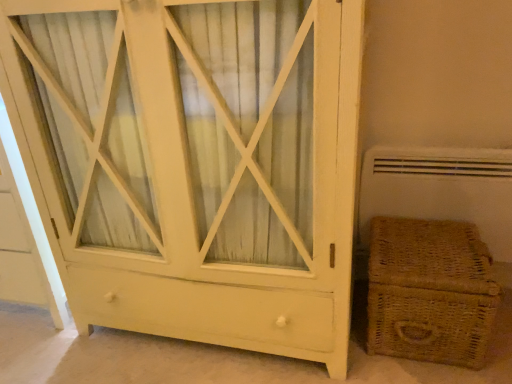
At what (x,y) coordinates should I click in order to perform the action: click on braided wicker basket at lower right. Please return your answer as a coordinate pair (x, y). The height and width of the screenshot is (384, 512). Looking at the image, I should click on (430, 291).

Describe the element at coordinates (430, 291) in the screenshot. I see `braided wicker basket at lower right` at that location.

This screenshot has width=512, height=384. Describe the element at coordinates (196, 175) in the screenshot. I see `white wood cabinet at center` at that location.

Find the location of a particular element. Image resolution: width=512 pixels, height=384 pixels. white wood cabinet at center is located at coordinates (196, 175).

The height and width of the screenshot is (384, 512). Find the location of `braided wicker basket at lower right`. braided wicker basket at lower right is located at coordinates (430, 291).

Considering the positions of objects white wood cabinet at center and braided wicker basket at lower right in the image provided, who is more to the left, white wood cabinet at center or braided wicker basket at lower right?

white wood cabinet at center is more to the left.

Is the depth of white wood cabinet at center less than that of braided wicker basket at lower right?

Yes, it is in front of braided wicker basket at lower right.

Does point (172, 86) lie behind point (484, 360)?

No, it is in front of (484, 360).

From the image's perspective, is white wood cabinet at center above braided wicker basket at lower right?

Indeed, from the image's perspective, white wood cabinet at center is shown above braided wicker basket at lower right.

From a real-world perspective, which object stands above the other?

white wood cabinet at center is physically above.

Which object is wider, white wood cabinet at center or braided wicker basket at lower right?

With larger width is white wood cabinet at center.

Is white wood cabinet at center shorter than braided wicker basket at lower right?

No, white wood cabinet at center is not shorter than braided wicker basket at lower right.

Can you confirm if white wood cabinet at center is bigger than braided wicker basket at lower right?

Indeed, white wood cabinet at center has a larger size compared to braided wicker basket at lower right.

Is white wood cabinet at center positioned beyond the bounds of braided wicker basket at lower right?

white wood cabinet at center lies outside braided wicker basket at lower right's area.

Is white wood cabinet at center with braided wicker basket at lower right?

white wood cabinet at center and braided wicker basket at lower right are clearly separated.

Is white wood cabinet at center positioned with its back to braided wicker basket at lower right?

That's not correct — white wood cabinet at center is not looking away from braided wicker basket at lower right.

How different are the orientations of white wood cabinet at center and braided wicker basket at lower right in degrees?

The facing directions of white wood cabinet at center and braided wicker basket at lower right are 1.19 degrees apart.

Measure the distance from white wood cabinet at center to braided wicker basket at lower right.

white wood cabinet at center is 20.46 inches from braided wicker basket at lower right.

You are a GUI agent. You are given a task and a screenshot of the screen. Output one action in this format:
    pyautogui.click(x=<x>, y=<y>)
    Task: Click on the chest of drawers on the left of braided wicker basket at lower right
    Image resolution: width=512 pixels, height=384 pixels.
    Given the screenshot: What is the action you would take?
    pyautogui.click(x=196, y=175)

In the image, is braided wicker basket at lower right on the left side or the right side of white wood cabinet at center?

In the image, braided wicker basket at lower right appears on the right side of white wood cabinet at center.

Which object is more forward, braided wicker basket at lower right or white wood cabinet at center?

Positioned in front is white wood cabinet at center.

Considering the points (475, 323) and (186, 251), which point is in front, point (475, 323) or point (186, 251)?

The point (475, 323) is closer to the camera.

From the image's perspective, relative to white wood cabinet at center, is braided wicker basket at lower right above or below?

Clearly, from the image's perspective, braided wicker basket at lower right is below white wood cabinet at center.

From a real-world perspective, between braided wicker basket at lower right and white wood cabinet at center, who is vertically higher?

In real-world perspective, white wood cabinet at center is above.

Is braided wicker basket at lower right thinner than white wood cabinet at center?

Indeed, braided wicker basket at lower right has a lesser width compared to white wood cabinet at center.

Can you confirm if braided wicker basket at lower right is taller than white wood cabinet at center?

No.

From the picture: Which of these two, braided wicker basket at lower right or white wood cabinet at center, is bigger?

white wood cabinet at center is bigger.

Could white wood cabinet at center be considered to be inside braided wicker basket at lower right?

No, white wood cabinet at center is located outside of braided wicker basket at lower right.

Are braided wicker basket at lower right and white wood cabinet at center beside each other?

No, braided wicker basket at lower right is not with white wood cabinet at center.

Is white wood cabinet at center at the back of braided wicker basket at lower right?

braided wicker basket at lower right does not have its back to white wood cabinet at center.

How different are the orientations of braided wicker basket at lower right and white wood cabinet at center in degrees?

1.19 degrees separate the facing orientations of braided wicker basket at lower right and white wood cabinet at center.

The height and width of the screenshot is (384, 512). I want to click on the chest of drawers that appears above the braided wicker basket at lower right (from the image's perspective), so click(x=196, y=175).

The image size is (512, 384). I want to click on basket below the white wood cabinet at center (from the image's perspective), so pyautogui.click(x=430, y=291).

Find the location of a particular element. the chest of drawers located above the braided wicker basket at lower right (from the image's perspective) is located at coordinates (196, 175).